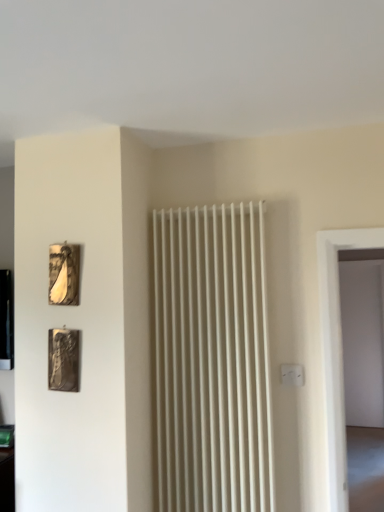
This screenshot has height=512, width=384. I want to click on metallic silver picture frame at lower left, the second picture frame viewed from the top, so click(x=63, y=360).

From the image's perspective, is metallic silver picture frame at lower left, the second picture frame viewed from the top, below white plastic electric outlet at center-right?

No, from the image's perspective, metallic silver picture frame at lower left, the second picture frame viewed from the top, is not beneath white plastic electric outlet at center-right.

Is metallic silver picture frame at lower left, which is counted as the 1th picture frame, starting from the bottom, positioned behind white plastic electric outlet at center-right?

That is False.

Considering the relative sizes of metallic silver picture frame at lower left, which is counted as the 1th picture frame, starting from the bottom, and white plastic electric outlet at center-right in the image provided, is metallic silver picture frame at lower left, which is counted as the 1th picture frame, starting from the bottom, shorter than white plastic electric outlet at center-right?

Incorrect, the height of metallic silver picture frame at lower left, which is counted as the 1th picture frame, starting from the bottom, does not fall short of that of white plastic electric outlet at center-right.

Which of these two, metallic silver picture frame at lower left, which is counted as the 1th picture frame, starting from the bottom, or white plastic electric outlet at center-right, is thinner?

white plastic electric outlet at center-right.

From a real-world perspective, does white plastic electric outlet at center-right sit lower than metallic silver picture frame at lower left, the second picture frame viewed from the top?

Yes, from a real-world perspective, white plastic electric outlet at center-right is beneath metallic silver picture frame at lower left, the second picture frame viewed from the top.

Is white plastic electric outlet at center-right not inside metallic silver picture frame at lower left, the second picture frame viewed from the top?

Yes, white plastic electric outlet at center-right is located beyond the bounds of metallic silver picture frame at lower left, the second picture frame viewed from the top.

Considering the positions of objects white plastic electric outlet at center-right and metallic silver picture frame at lower left, which is counted as the 1th picture frame, starting from the bottom, in the image provided, who is behind, white plastic electric outlet at center-right or metallic silver picture frame at lower left, which is counted as the 1th picture frame, starting from the bottom,?

white plastic electric outlet at center-right is further from the camera.

Does point (303, 375) come closer to viewer compared to point (69, 375)?

No, it is not.

From a real-world perspective, does metallic gold picture frame at upper left, placed as the 1th picture frame when sorted from top to bottom, sit lower than metallic silver picture frame at lower left, which is counted as the 1th picture frame, starting from the bottom?

Incorrect, from a real-world perspective, metallic gold picture frame at upper left, placed as the 1th picture frame when sorted from top to bottom, is higher than metallic silver picture frame at lower left, which is counted as the 1th picture frame, starting from the bottom.

Can you confirm if metallic gold picture frame at upper left, placed as the 1th picture frame when sorted from top to bottom, is bigger than metallic silver picture frame at lower left, the second picture frame viewed from the top?

Incorrect, metallic gold picture frame at upper left, placed as the 1th picture frame when sorted from top to bottom, is not larger than metallic silver picture frame at lower left, the second picture frame viewed from the top.

Is metallic gold picture frame at upper left, placed as the 1th picture frame when sorted from top to bottom, at the left side of metallic silver picture frame at lower left, the second picture frame viewed from the top?

Indeed, metallic gold picture frame at upper left, placed as the 1th picture frame when sorted from top to bottom, is positioned on the left side of metallic silver picture frame at lower left, the second picture frame viewed from the top.

Are metallic gold picture frame at upper left, placed as the 1th picture frame when sorted from top to bottom, and metallic silver picture frame at lower left, which is counted as the 1th picture frame, starting from the bottom, making contact?

No.

Between metallic gold picture frame at upper left, arranged as the 2th picture frame when ordered from the bottom, and white plastic electric outlet at center-right, which one has larger width?

Wider between the two is metallic gold picture frame at upper left, arranged as the 2th picture frame when ordered from the bottom.

Which is in front, point (50, 251) or point (285, 367)?

The point (50, 251) is closer.

Based on the photo, is metallic gold picture frame at upper left, placed as the 1th picture frame when sorted from top to bottom, with white plastic electric outlet at center-right?

No.

Is metallic gold picture frame at upper left, placed as the 1th picture frame when sorted from top to bottom, facing away from white plastic electric outlet at center-right?

No, metallic gold picture frame at upper left, placed as the 1th picture frame when sorted from top to bottom,'s orientation is not away from white plastic electric outlet at center-right.

How far apart are metallic silver picture frame at lower left, the second picture frame viewed from the top, and metallic gold picture frame at upper left, placed as the 1th picture frame when sorted from top to bottom?

metallic silver picture frame at lower left, the second picture frame viewed from the top, is 9.08 inches from metallic gold picture frame at upper left, placed as the 1th picture frame when sorted from top to bottom.

Can you confirm if metallic silver picture frame at lower left, which is counted as the 1th picture frame, starting from the bottom, is bigger than metallic gold picture frame at upper left, arranged as the 2th picture frame when ordered from the bottom?

Yes.

From a real-world perspective, is metallic silver picture frame at lower left, the second picture frame viewed from the top, above or below metallic gold picture frame at upper left, arranged as the 2th picture frame when ordered from the bottom?

metallic silver picture frame at lower left, the second picture frame viewed from the top, is situated lower than metallic gold picture frame at upper left, arranged as the 2th picture frame when ordered from the bottom, in the real world.

Would you say metallic silver picture frame at lower left, which is counted as the 1th picture frame, starting from the bottom, is outside metallic gold picture frame at upper left, placed as the 1th picture frame when sorted from top to bottom?

Indeed, metallic silver picture frame at lower left, which is counted as the 1th picture frame, starting from the bottom, is completely outside metallic gold picture frame at upper left, placed as the 1th picture frame when sorted from top to bottom.

From the image's perspective, between white plastic electric outlet at center-right and metallic gold picture frame at upper left, placed as the 1th picture frame when sorted from top to bottom, who is located below?

white plastic electric outlet at center-right appears lower in the image.

Can you confirm if white plastic electric outlet at center-right is positioned to the right of metallic gold picture frame at upper left, arranged as the 2th picture frame when ordered from the bottom?

Yes.

Is white plastic electric outlet at center-right wider than metallic gold picture frame at upper left, placed as the 1th picture frame when sorted from top to bottom?

No, white plastic electric outlet at center-right is not wider than metallic gold picture frame at upper left, placed as the 1th picture frame when sorted from top to bottom.

At what (x,y) coordinates should I click in order to perform the action: click on electric outlet lying behind the metallic silver picture frame at lower left, the second picture frame viewed from the top. Please return your answer as a coordinate pair (x, y). Looking at the image, I should click on (292, 374).

The height and width of the screenshot is (512, 384). I want to click on the 1st picture frame positioned above the white plastic electric outlet at center-right (from a real-world perspective), so click(63, 360).

From the image, which object appears to be nearer to metallic silver picture frame at lower left, which is counted as the 1th picture frame, starting from the bottom, metallic gold picture frame at upper left, arranged as the 2th picture frame when ordered from the bottom, or white plastic electric outlet at center-right?

metallic gold picture frame at upper left, arranged as the 2th picture frame when ordered from the bottom, lies closer to metallic silver picture frame at lower left, which is counted as the 1th picture frame, starting from the bottom, than the other object.

Considering their positions, is metallic gold picture frame at upper left, arranged as the 2th picture frame when ordered from the bottom, positioned further to white plastic electric outlet at center-right than metallic silver picture frame at lower left, which is counted as the 1th picture frame, starting from the bottom?

The object further to white plastic electric outlet at center-right is metallic gold picture frame at upper left, arranged as the 2th picture frame when ordered from the bottom.

Estimate the real-world distances between objects in this image. Which object is closer to metallic gold picture frame at upper left, arranged as the 2th picture frame when ordered from the bottom, white plastic electric outlet at center-right or metallic silver picture frame at lower left, the second picture frame viewed from the top?

metallic silver picture frame at lower left, the second picture frame viewed from the top.

From the image, which object appears to be nearer to white plastic electric outlet at center-right, metallic silver picture frame at lower left, the second picture frame viewed from the top, or metallic gold picture frame at upper left, placed as the 1th picture frame when sorted from top to bottom?

metallic silver picture frame at lower left, the second picture frame viewed from the top, is closer to white plastic electric outlet at center-right.

Which object lies nearer to the anchor point metallic silver picture frame at lower left, which is counted as the 1th picture frame, starting from the bottom, white plastic electric outlet at center-right or metallic gold picture frame at upper left, arranged as the 2th picture frame when ordered from the bottom?

metallic gold picture frame at upper left, arranged as the 2th picture frame when ordered from the bottom, is positioned closer to the anchor metallic silver picture frame at lower left, which is counted as the 1th picture frame, starting from the bottom.

From the image, which object appears to be nearer to metallic gold picture frame at upper left, placed as the 1th picture frame when sorted from top to bottom, metallic silver picture frame at lower left, the second picture frame viewed from the top, or white plastic electric outlet at center-right?

metallic silver picture frame at lower left, the second picture frame viewed from the top, is closer to metallic gold picture frame at upper left, placed as the 1th picture frame when sorted from top to bottom.

This screenshot has width=384, height=512. Identify the location of picture frame situated between metallic gold picture frame at upper left, arranged as the 2th picture frame when ordered from the bottom, and white plastic electric outlet at center-right from left to right. (63, 360).